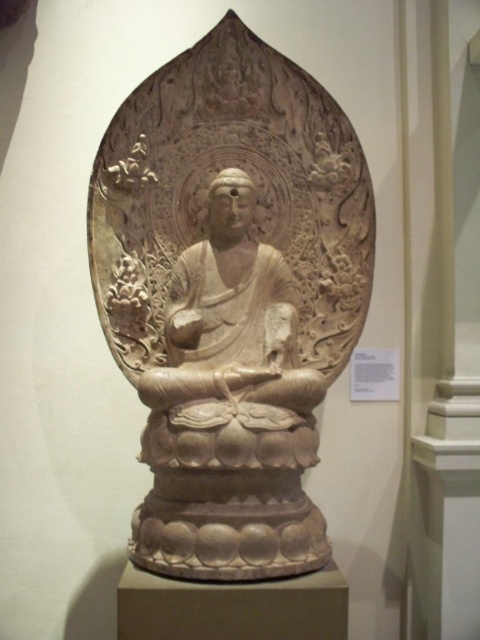
You are standing in front of an ornate stone sculpture of a seated Buddha, which is framed by a mandala arch filled with intricate carvings. The sculpture is positioned at the center of the scene. If you want to take a close look at the small celestial figures carved into the mandala arch, should you move closer to or further away from the beige stone buddha at center?

The beige stone buddha at center is 11.15 feet away from the camera. To examine the small celestial figures carved into the mandala arch more closely, you should move closer to the beige stone buddha at center. This will allow you to get a better view of the intricate details in the surrounding mandala arch.

You are an art curator arranging a gallery exhibit. You have two statues displayed in the center of the room. The beige stone buddha at center and the white stone statue at center. According to the image, which one is positioned to the left?

The beige stone buddha at center is positioned to the left of the white stone statue at center.

You are standing in front of the stone sculpture of the seated figure. There are two points marked on the sculpture. One is at coordinate point (273, 68) and the other is at point (256, 436). From your perspective, which point is closer to you?

Point (256, 436) is closer to you because it is in front of point (273, 68).